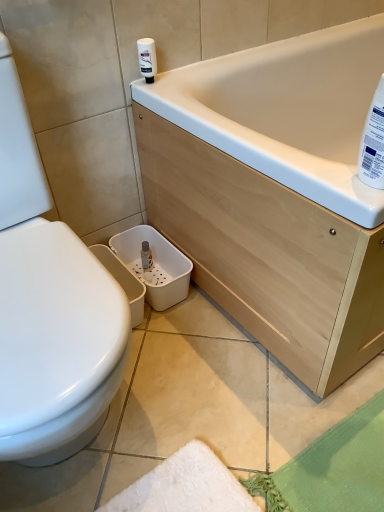
Question: Would you say white plastic bottle at upper right, the second cleaning product from the left, is to the left or to the right of white plastic bottle at upper center, which is the 1th cleaning product in back-to-front order, in the picture?

Choices:
 (A) left
 (B) right

Answer: (B)

Question: Considering the positions of white plastic bottle at upper right, placed as the 2th cleaning product when sorted from back to front, and white plastic bottle at upper center, which is the 1th cleaning product in back-to-front order, in the image, is white plastic bottle at upper right, placed as the 2th cleaning product when sorted from back to front, bigger or smaller than white plastic bottle at upper center, which is the 1th cleaning product in back-to-front order,?

Choices:
 (A) small
 (B) big

Answer: (B)

Question: From a real-world perspective, is white plastic bottle at upper right, the 1th cleaning product ordered from the bottom, physically located above or below white plastic bottle at upper center, the 2th cleaning product ordered from the bottom?

Choices:
 (A) below
 (B) above

Answer: (B)

Question: Considering the positions of point (137, 39) and point (380, 141), is point (137, 39) closer or farther from the camera than point (380, 141)?

Choices:
 (A) closer
 (B) farther

Answer: (B)

Question: Is white plastic bottle at upper center, which is the 1th cleaning product in back-to-front order, inside or outside of white plastic bottle at upper right, the second cleaning product from the top?

Choices:
 (A) outside
 (B) inside

Answer: (A)

Question: Considering the positions of white plastic bottle at upper center, the 2th cleaning product ordered from the bottom, and white plastic bottle at upper right, placed as the 2th cleaning product when sorted from back to front, in the image, is white plastic bottle at upper center, the 2th cleaning product ordered from the bottom, bigger or smaller than white plastic bottle at upper right, placed as the 2th cleaning product when sorted from back to front,?

Choices:
 (A) big
 (B) small

Answer: (B)

Question: From the image's perspective, is white plastic bottle at upper center, which is the 1th cleaning product in back-to-front order, positioned above or below white plastic bottle at upper right, which ranks as the 1th cleaning product in front-to-back order?

Choices:
 (A) above
 (B) below

Answer: (A)